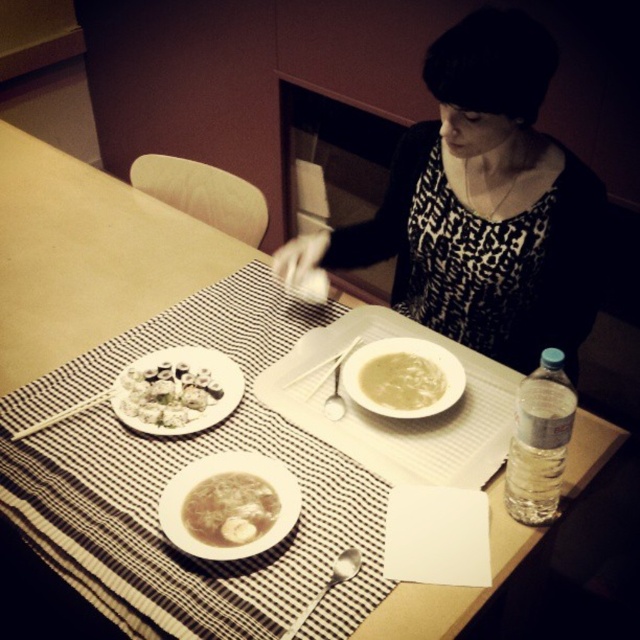
Is the position of white porcelain bowl at center less distant than that of white matte dumplings at center?

Yes, it is in front of white matte dumplings at center.

Can you confirm if white porcelain bowl at center is thinner than white matte dumplings at center?

No, white porcelain bowl at center is not thinner than white matte dumplings at center.

Which is in front, point (445, 396) or point (120, 408)?

Positioned in front is point (120, 408).

Find the location of a particular element. The image size is (640, 640). white porcelain bowl at center is located at coordinates (403, 378).

In the scene shown: Which is above, black leopard print dress at upper center or satin silver spoon at lower center?

Positioned higher is black leopard print dress at upper center.

Can you confirm if black leopard print dress at upper center is taller than satin silver spoon at lower center?

Yes.

This screenshot has height=640, width=640. Describe the element at coordinates (483, 204) in the screenshot. I see `black leopard print dress at upper center` at that location.

Find the location of a particular element. This screenshot has width=640, height=640. black leopard print dress at upper center is located at coordinates [483, 204].

Does white matte plate at center have a smaller size compared to white matte dumplings at center?

No.

Does white matte plate at center have a larger size compared to white matte dumplings at center?

Indeed, white matte plate at center has a larger size compared to white matte dumplings at center.

Between point (294, 480) and point (150, 396), which one is positioned in front?

Point (294, 480)

Find the location of a particular element. The height and width of the screenshot is (640, 640). white matte plate at center is located at coordinates (227, 472).